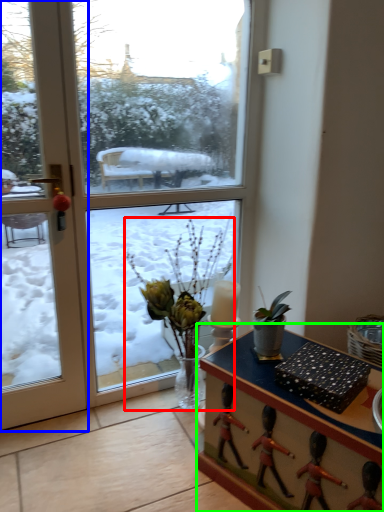
Question: Which object is the closest to the houseplant (highlighted by a red box)? Choose among these: door (highlighted by a blue box) or desk (highlighted by a green box).

Choices:
 (A) door
 (B) desk

Answer: (B)